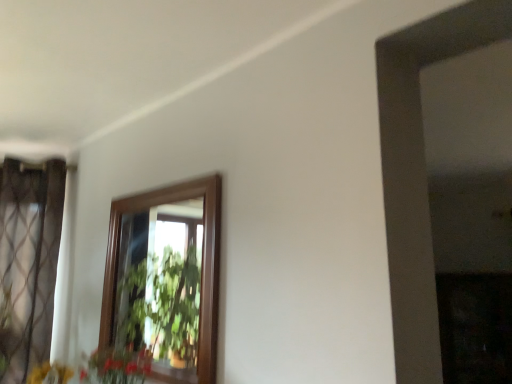
This screenshot has width=512, height=384. What do you see at coordinates (28, 261) in the screenshot? I see `brown sheer curtain at left` at bounding box center [28, 261].

The height and width of the screenshot is (384, 512). I want to click on brown sheer curtain at left, so click(x=28, y=261).

In order to face brown sheer curtain at left, should I rotate leftwards or rightwards?

It's best to rotate left around 31.023 degrees.

Find the location of a particular element. brown sheer curtain at left is located at coordinates (28, 261).